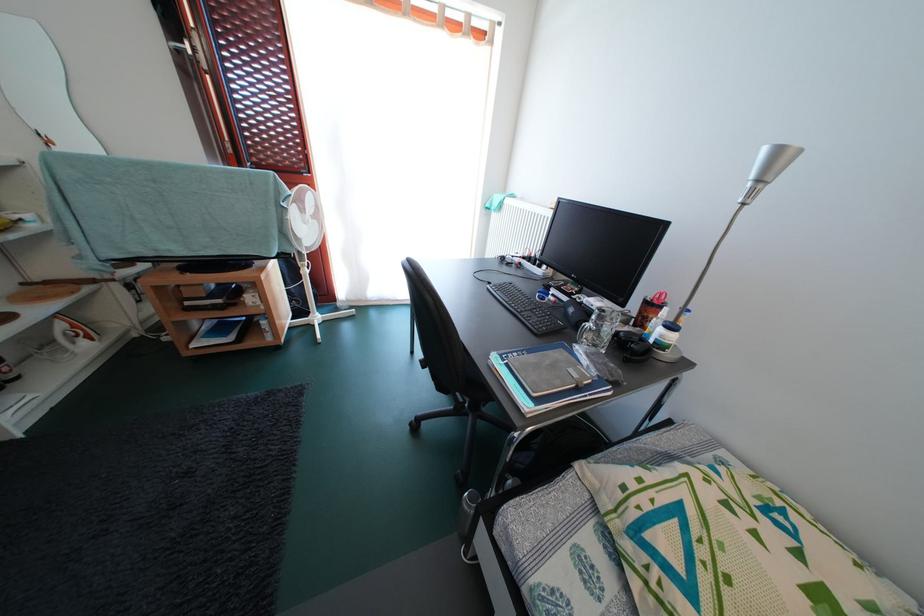
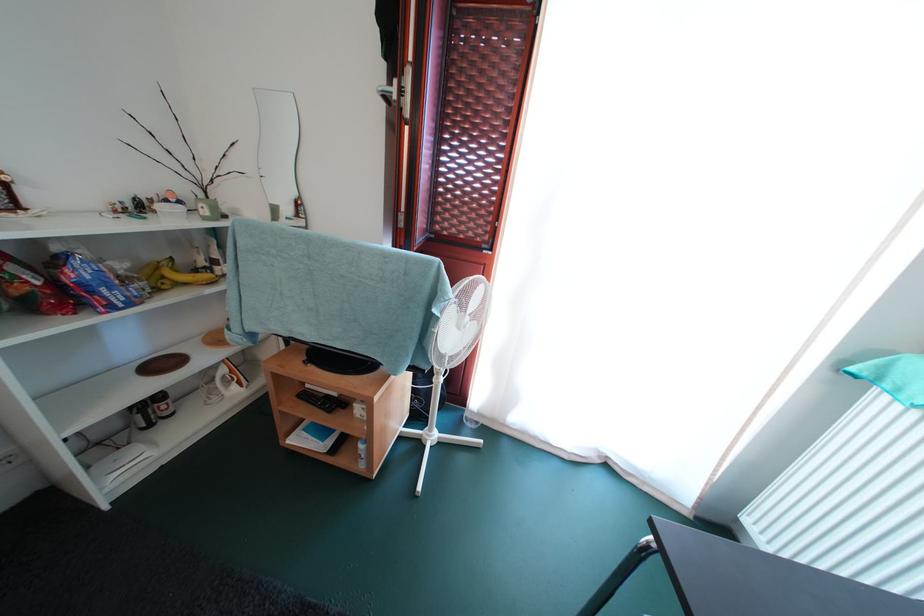
Find the pixel in the second image that matches pixel 266 331 in the first image.

(363, 453)